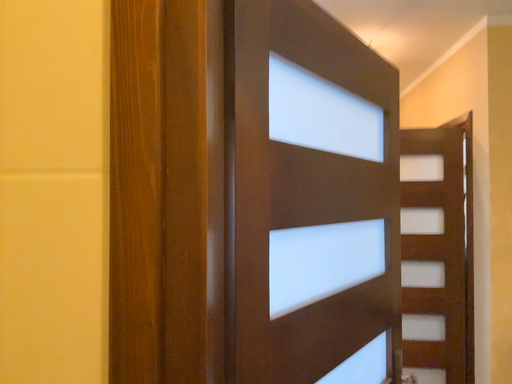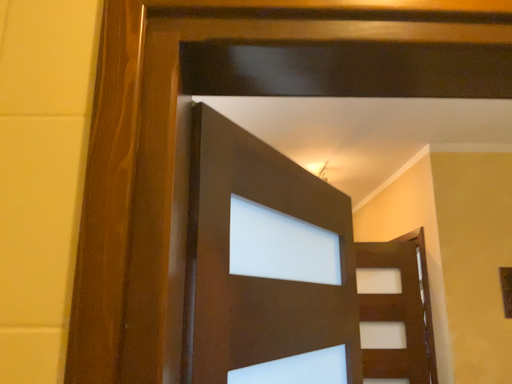
Question: Which way did the camera rotate in the video?

Choices:
 (A) rotated downward
 (B) rotated upward

Answer: (B)